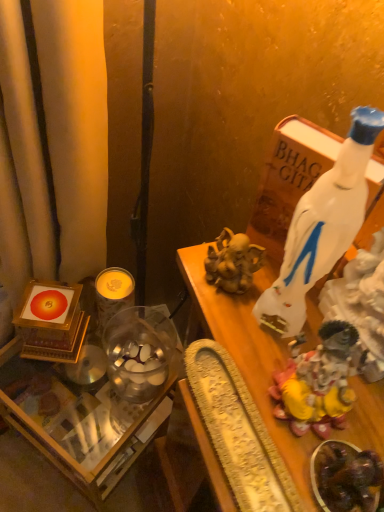
Question: From a real-world perspective, does yellow wax candle at center left sit lower than shiny gold statue at right?

Choices:
 (A) yes
 (B) no

Answer: (A)

Question: Is yellow wax candle at center left to the right of shiny gold statue at right from the viewer's perspective?

Choices:
 (A) no
 (B) yes

Answer: (A)

Question: Are yellow wax candle at center left and shiny gold statue at right located far from each other?

Choices:
 (A) yes
 (B) no

Answer: (B)

Question: Can you confirm if yellow wax candle at center left is positioned to the left of shiny gold statue at right?

Choices:
 (A) yes
 (B) no

Answer: (A)

Question: Is yellow wax candle at center left positioned with its back to shiny gold statue at right?

Choices:
 (A) yes
 (B) no

Answer: (B)

Question: Is yellow wax candle at center left bigger than shiny gold statue at right?

Choices:
 (A) yes
 (B) no

Answer: (A)

Question: Does white glossy bottle at upper right have a greater height compared to yellow wax candle at center left?

Choices:
 (A) yes
 (B) no

Answer: (A)

Question: Is white glossy bottle at upper right positioned beyond the bounds of yellow wax candle at center left?

Choices:
 (A) yes
 (B) no

Answer: (A)

Question: From the image's perspective, would you say white glossy bottle at upper right is positioned over yellow wax candle at center left?

Choices:
 (A) no
 (B) yes

Answer: (B)

Question: Would you consider white glossy bottle at upper right to be distant from yellow wax candle at center left?

Choices:
 (A) yes
 (B) no

Answer: (B)

Question: Does white glossy bottle at upper right have a smaller size compared to yellow wax candle at center left?

Choices:
 (A) yes
 (B) no

Answer: (B)

Question: Is yellow wax candle at center left at the back of white glossy bottle at upper right?

Choices:
 (A) yes
 (B) no

Answer: (B)

Question: From the image's perspective, is shiny dark chocolate at lower right on shiny gold statue at right?

Choices:
 (A) yes
 (B) no

Answer: (B)